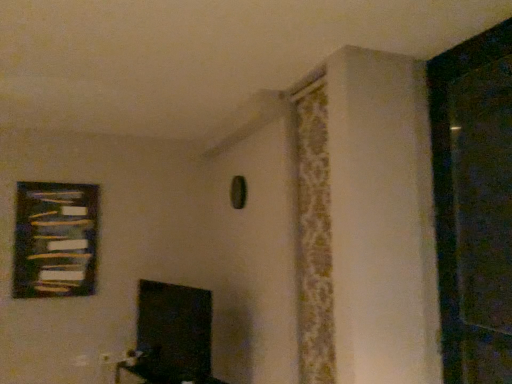
Question: Is matte black tv at lower center facing towards wooden frame at upper left?

Choices:
 (A) yes
 (B) no

Answer: (B)

Question: Can you see matte black tv at lower center touching wooden frame at upper left?

Choices:
 (A) no
 (B) yes

Answer: (A)

Question: From the image's perspective, does matte black tv at lower center appear higher than wooden frame at upper left?

Choices:
 (A) no
 (B) yes

Answer: (A)

Question: Is matte black tv at lower center wider than wooden frame at upper left?

Choices:
 (A) no
 (B) yes

Answer: (B)

Question: Are matte black tv at lower center and wooden frame at upper left far apart?

Choices:
 (A) yes
 (B) no

Answer: (A)

Question: Can you confirm if matte black tv at lower center is thinner than wooden frame at upper left?

Choices:
 (A) yes
 (B) no

Answer: (B)

Question: Considering the relative sizes of matte black tv at lower center and patterned fabric curtain at upper right in the image provided, is matte black tv at lower center smaller than patterned fabric curtain at upper right?

Choices:
 (A) yes
 (B) no

Answer: (B)

Question: Is matte black tv at lower center oriented towards patterned fabric curtain at upper right?

Choices:
 (A) no
 (B) yes

Answer: (A)

Question: Is matte black tv at lower center not near patterned fabric curtain at upper right?

Choices:
 (A) no
 (B) yes

Answer: (B)

Question: Considering the relative sizes of matte black tv at lower center and patterned fabric curtain at upper right in the image provided, is matte black tv at lower center thinner than patterned fabric curtain at upper right?

Choices:
 (A) no
 (B) yes

Answer: (A)

Question: Can you confirm if matte black tv at lower center is wider than patterned fabric curtain at upper right?

Choices:
 (A) yes
 (B) no

Answer: (A)

Question: Is matte black tv at lower center at the right side of patterned fabric curtain at upper right?

Choices:
 (A) no
 (B) yes

Answer: (A)

Question: Could you tell me if black matte screen door at right is turned towards wooden frame at upper left?

Choices:
 (A) no
 (B) yes

Answer: (A)